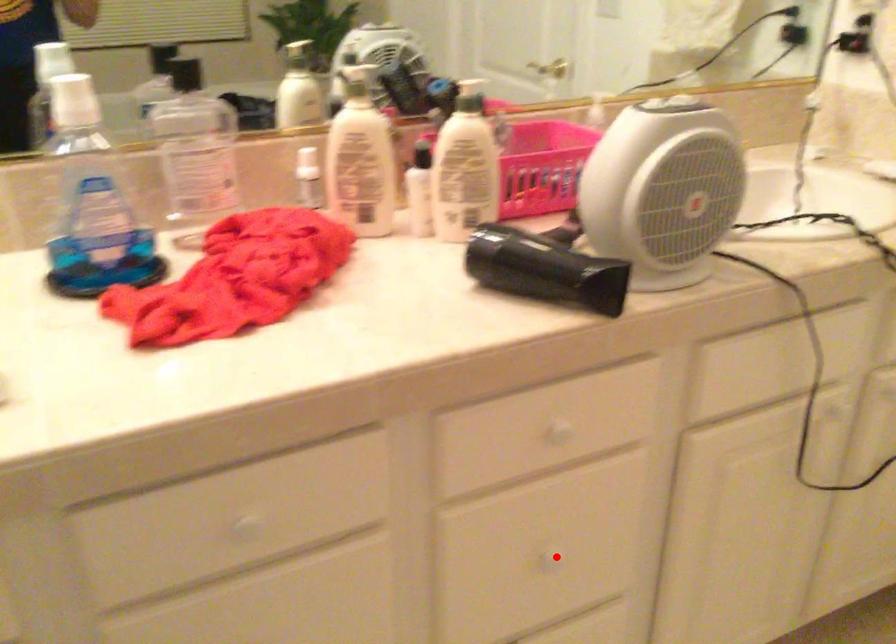
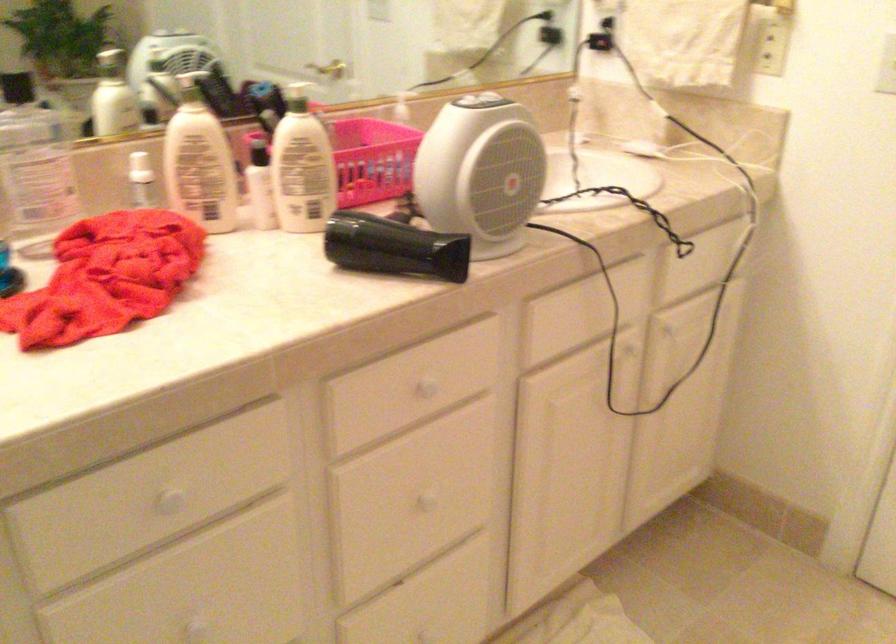
Question: I am providing you with two images of the same scene from different viewpoints. In image1, a red point is highlighted. Considering the same 3D point in image2, which of the following is correct?

Choices:
 (A) It is closer
 (B) It is farther

Answer: (B)